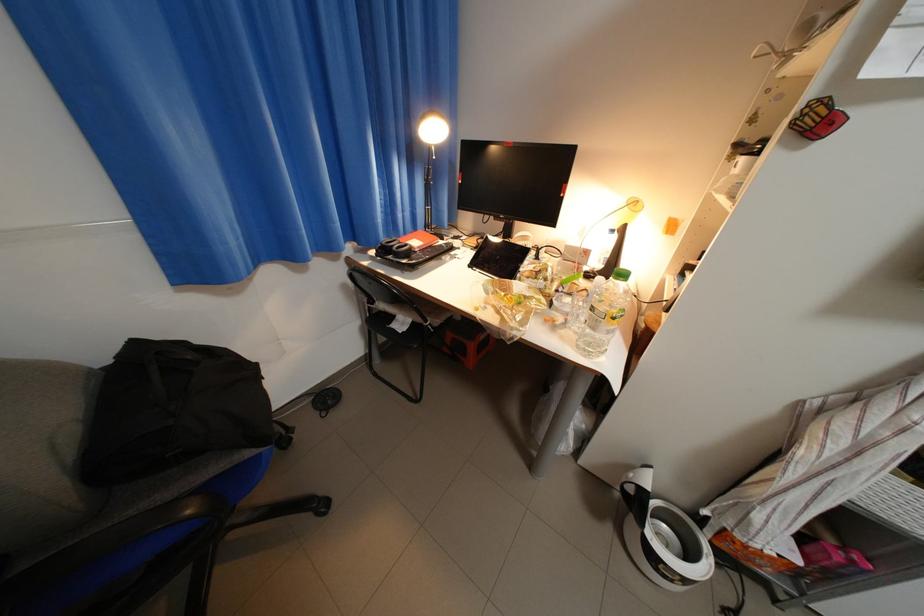
Where would you sit the grey chair sitting surface? Please return your answer as a coordinate pair (x, y).

(391, 323)